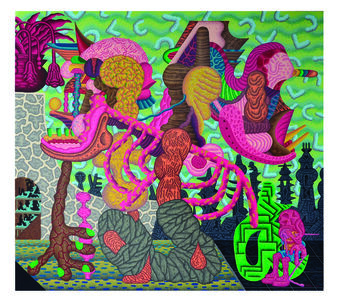
Locate an element on the screen. The image size is (338, 299). shelves is located at coordinates (22, 225), (27, 211), (27, 197).